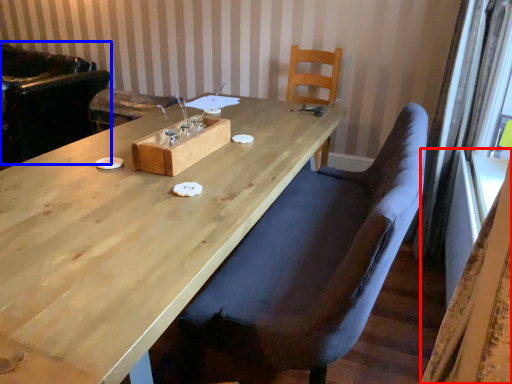
Question: Among these objects, which one is farthest to the camera, curtain (highlighted by a red box) or armchair (highlighted by a blue box)?

Choices:
 (A) curtain
 (B) armchair

Answer: (B)